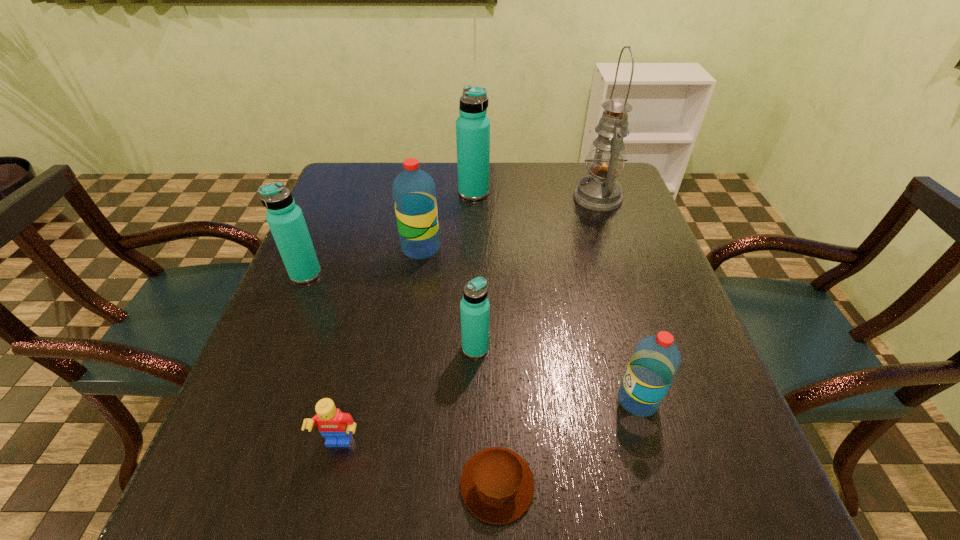
This screenshot has height=540, width=960. What are the coordinates of `the third closest blue water bottle to the second water bottle from left to right` in the screenshot? It's located at (474, 307).

Locate an element on the screen. Image resolution: width=960 pixels, height=540 pixels. blue water bottle that is the closest to the fourth farthest water bottle is located at coordinates (285, 219).